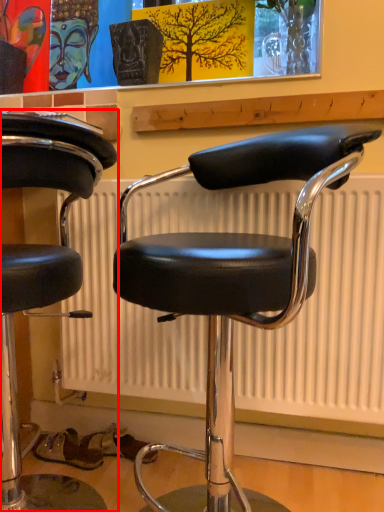
Question: Where is chair (annotated by the red box) located in relation to chair in the image?

Choices:
 (A) left
 (B) right

Answer: (A)